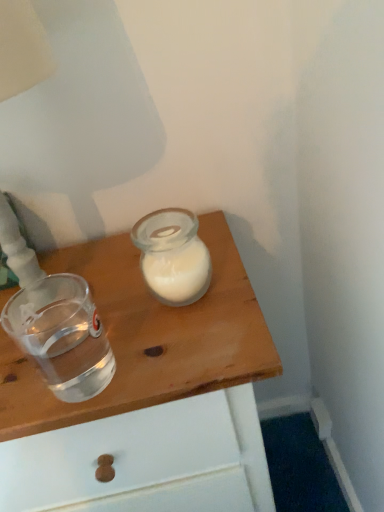
The height and width of the screenshot is (512, 384). I want to click on free space to the right of transparent plastic shot glass at left, so click(181, 343).